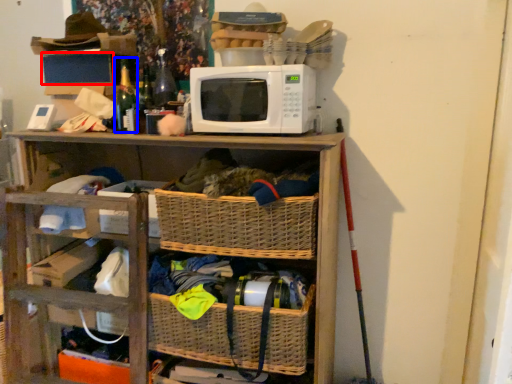
Question: Which object appears farthest to the camera in this image, storage box (highlighted by a red box) or bottle (highlighted by a blue box)?

Choices:
 (A) storage box
 (B) bottle

Answer: (A)